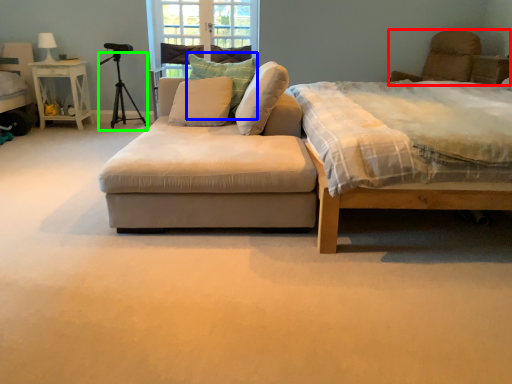
Question: Which is nearer to the swivel chair (highlighted by a red box)? pillow (highlighted by a blue box) or tripod (highlighted by a green box).

Choices:
 (A) pillow
 (B) tripod

Answer: (A)